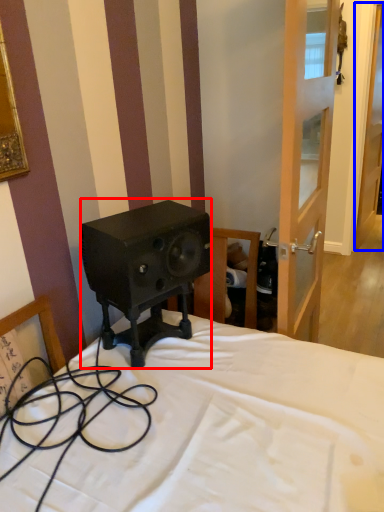
Question: Which of the following is the farthest to the observer, loudspeaker (highlighted by a red box) or door (highlighted by a blue box)?

Choices:
 (A) loudspeaker
 (B) door

Answer: (B)